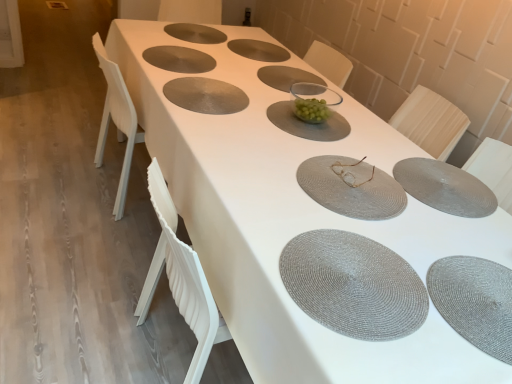
The image size is (512, 384). Find the location of `unoccupied space behind gold metallic glasses at center, which is the fourth tableware from bottom to top`. unoccupied space behind gold metallic glasses at center, which is the fourth tableware from bottom to top is located at coordinates (338, 141).